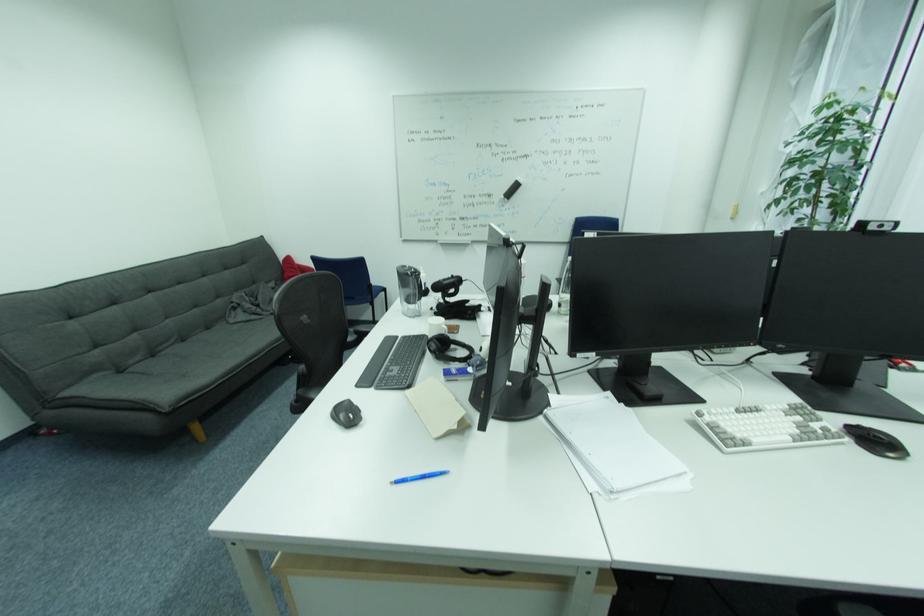
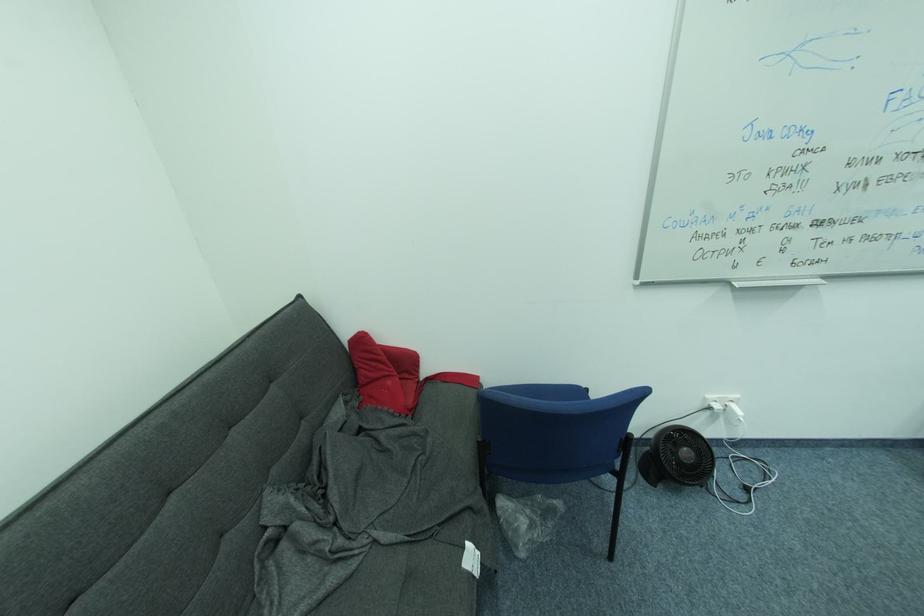
In a continuous first-person perspective shot, in which direction is the camera moving?

The movement direction of the cameraman is left, forward.